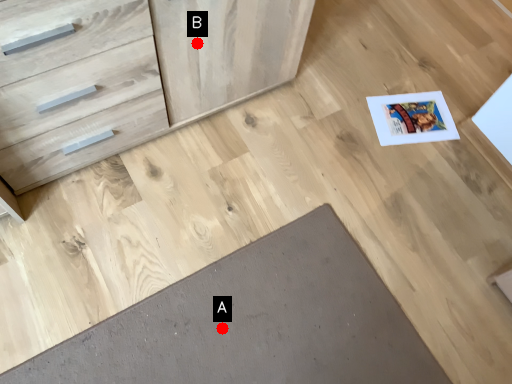
Question: Two points are circled on the image, labeled by A and B beside each circle. Among these points, which one is farthest from the camera?

Choices:
 (A) A is further
 (B) B is further

Answer: (A)